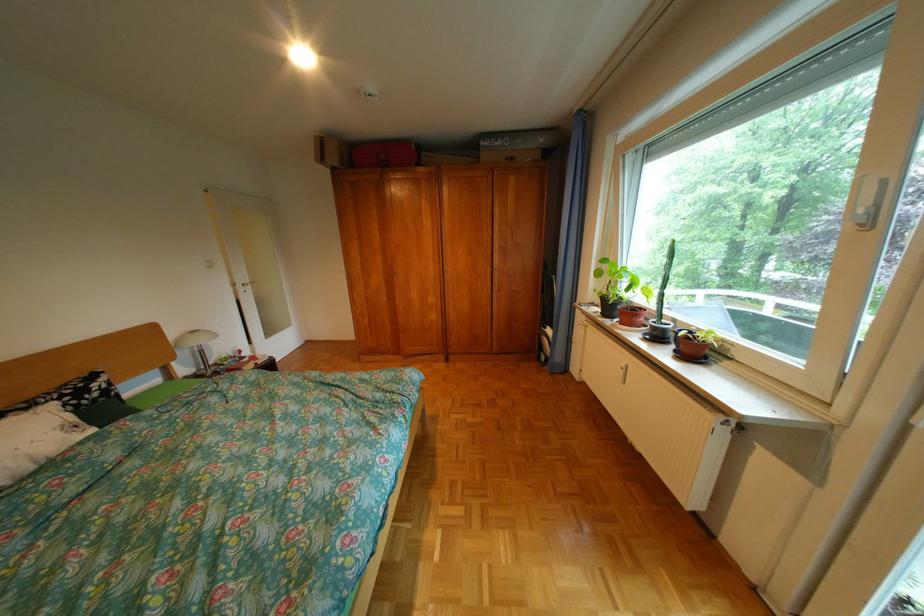
Image resolution: width=924 pixels, height=616 pixels. What do you see at coordinates (867, 204) in the screenshot? I see `the white window handle` at bounding box center [867, 204].